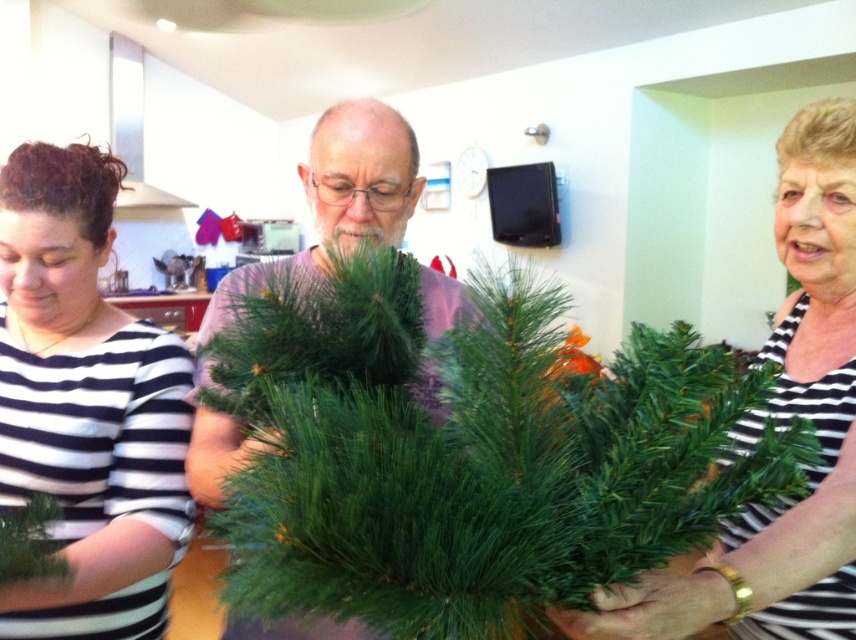
You are an interior designer observing the scene. You need to place a decorative item between the black striped shirt at left and the green matte pine branch at right. Which side should you place it closer to to ensure it is centered between them?

The black striped shirt at left is positioned on the left side of the green matte pine branch at right. To center the decorative item between them, place it closer to the green matte pine branch at right.

You are organizing a Christmas decoration event and have two types of greenery to arrange. You have a green artificial at center and a green matte pine branch at right. Which one is wider?

The green artificial at center is wider than the green matte pine branch at right.

You are standing in the kitchen and want to hand a tool to both the person wearing the black striped shirt at left and the person holding the green artificial tree at center. Which person should you approach first to reach them more quickly?

You should approach the black striped shirt at left first because it is closer to you than the green artificial tree at center, so you can reach them more quickly.